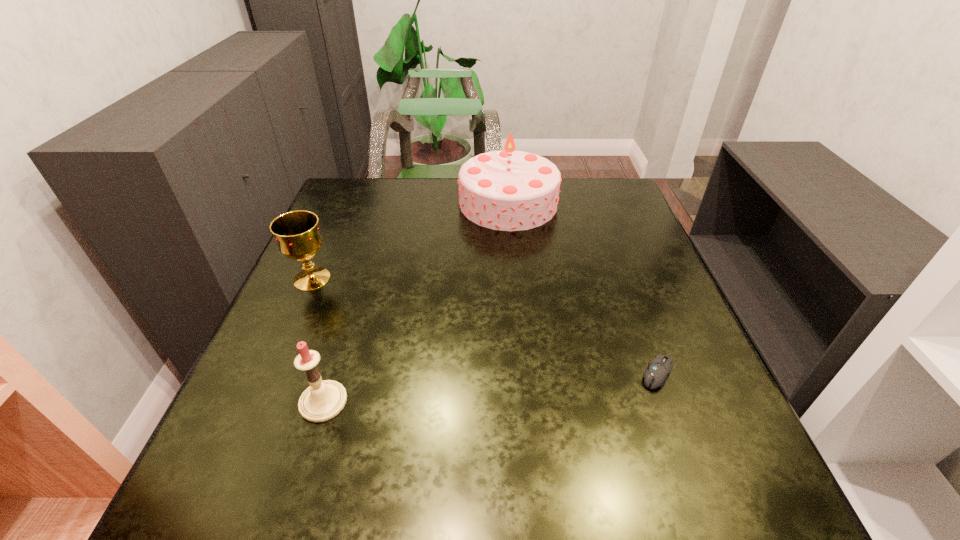
Identify the location of free space located on the back of the rightmost object. This screenshot has height=540, width=960. click(624, 281).

You are a GUI agent. You are given a task and a screenshot of the screen. Output one action in this format:
    pyautogui.click(x=<x>, y=<y>)
    Task: Click on the object that is at the far edge
    The width and height of the screenshot is (960, 540).
    Given the screenshot: What is the action you would take?
    pyautogui.click(x=508, y=190)

At what (x,y) coordinates should I click in order to perform the action: click on chalice located at the left edge. Please return your answer as a coordinate pair (x, y). Image resolution: width=960 pixels, height=540 pixels. Looking at the image, I should click on (297, 234).

At what (x,y) coordinates should I click in order to perform the action: click on candle positioned at the left edge. Please return your answer as a coordinate pair (x, y). Image resolution: width=960 pixels, height=540 pixels. Looking at the image, I should click on (322, 400).

This screenshot has width=960, height=540. What are the coordinates of `object that is positioned at the right edge` in the screenshot? It's located at click(655, 375).

The height and width of the screenshot is (540, 960). I want to click on free spot at the near edge of the desktop, so click(x=607, y=480).

In the image, there is a desktop. Identify the location of vacant area at the left edge. (299, 354).

At what (x,y) coordinates should I click in order to perform the action: click on free spot at the right edge of the desktop. Please return your answer as a coordinate pair (x, y). The image size is (960, 540). Looking at the image, I should click on (682, 381).

Image resolution: width=960 pixels, height=540 pixels. Identify the location of free space at the far left corner. (344, 181).

Find the location of a particular element. This screenshot has width=960, height=540. vacant region between the leftmost object and the second object from right to left is located at coordinates point(410,241).